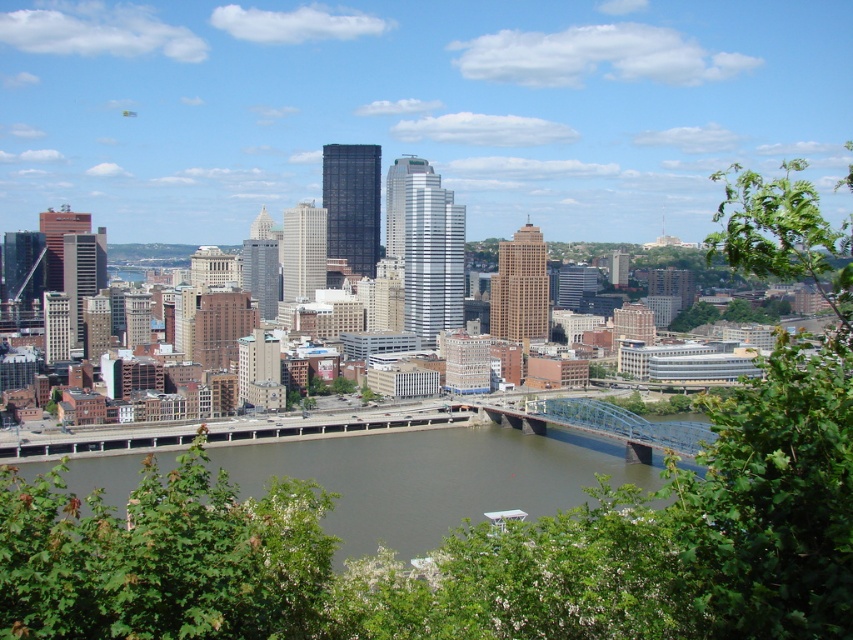
You are a city planner reviewing the Pittsburgh skyline. You notice the brown concrete river at center and the blue metallic bridge at center. Which of these two features occupies a larger area in the image?

The brown concrete river at center is bigger than the blue metallic bridge at center, so the river occupies a larger area in the image.

You are a city planner analyzing the layout of Pittsburgh. You need to place a new observation deck on the tallest building in the center. To ensure the deck has an unobstructed view of the brown concrete river at center, what should you consider about the building and river positions?

The brown concrete river at center is located at coordinates point (x=433, y=477), so the observation deck should be positioned on the tallest building in the center facing towards those coordinates to ensure an unobstructed view of the river.

You are standing at a viewpoint overlooking the city. There are two points marked on the river surface in the image. The first point is at coordinates point (579, 472) and the second point is at point (515, 422). Which point is closer to you?

Point (579, 472) is closer to the viewer than point (515, 422).